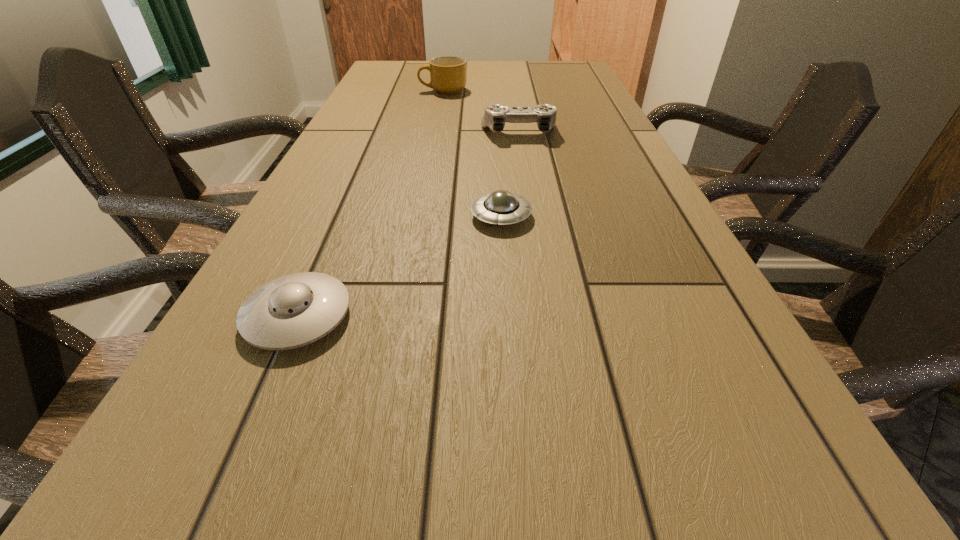
Locate an element on the screen. Image resolution: width=960 pixels, height=540 pixels. the farthest object is located at coordinates (448, 76).

Locate an element on the screen. The width and height of the screenshot is (960, 540). mug is located at coordinates (448, 76).

Where is `the second tallest object`? Image resolution: width=960 pixels, height=540 pixels. the second tallest object is located at coordinates (495, 115).

Locate an element on the screen. This screenshot has height=540, width=960. control is located at coordinates (495, 115).

Locate an element on the screen. The width and height of the screenshot is (960, 540). the second nearest object is located at coordinates [x=501, y=207].

Find the location of a particular element. the right saucer is located at coordinates (501, 207).

Where is `the nearest object`? the nearest object is located at coordinates (292, 311).

The height and width of the screenshot is (540, 960). I want to click on the nearer saucer, so click(292, 311).

I want to click on free region located 0.070m on the side with the handle of the tallest object, so click(397, 90).

You are a GUI agent. You are given a task and a screenshot of the screen. Output one action in this format:
    pyautogui.click(x=<x>, y=<y>)
    Task: Click on the free space located on the side with the handle of the tallest object
    The height and width of the screenshot is (540, 960).
    Given the screenshot: What is the action you would take?
    pyautogui.click(x=392, y=90)